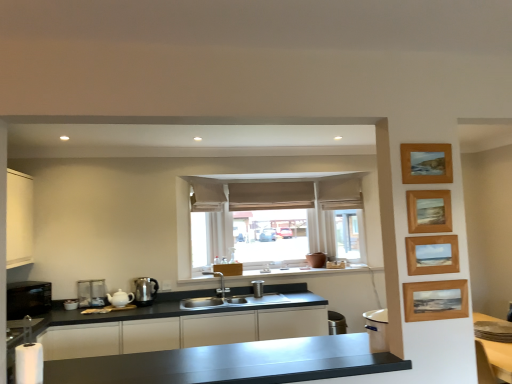
Image resolution: width=512 pixels, height=384 pixels. What do you see at coordinates (19, 219) in the screenshot?
I see `white matte cabinet at left, the 1th cabinetry from the left` at bounding box center [19, 219].

Identify the location of white matte cabinet at left, the 2th cabinetry positioned from the bottom. (19, 219).

How much space does wooden picture frame at upper right, which is counted as the fourth picture frame, starting from the bottom, occupy horizontally?

1.25 inches.

At what (x,y) coordinates should I click in order to perform the action: click on white glossy window sill at center. Please return your answer as a coordinate pair (x, y). Looking at the image, I should click on (297, 273).

Describe the element at coordinates (233, 363) in the screenshot. The height and width of the screenshot is (384, 512). I see `satin black countertop at lower left` at that location.

Where is `white fabric curtain at upper center, arranged as the third curtain when viewed from the right`? white fabric curtain at upper center, arranged as the third curtain when viewed from the right is located at coordinates (207, 196).

In order to face satin black countertop at center, which is the 1th cabinetry from bottom to top, should I rotate leftwards or rightwards?

A 7.778 degree turn to the left will do.

Describe the element at coordinates (91, 293) in the screenshot. I see `satin black coffee machine at lower left` at that location.

Locate an element on the screen. Image resolution: width=512 pixels, height=384 pixels. white matte cabinet at left, placed as the 1th cabinetry when sorted from top to bottom is located at coordinates (19, 219).

Is satin black countertop at center, placed as the 2th cabinetry when sorted from left to right, in front of or behind satin silver canister at center, the 1th appliance in the right-to-left sequence, in the image?

Visually, satin black countertop at center, placed as the 2th cabinetry when sorted from left to right, is located in front of satin silver canister at center, the 1th appliance in the right-to-left sequence.

From a real-world perspective, who is located lower, satin black countertop at center, arranged as the 1th cabinetry when viewed from the right, or satin silver canister at center, the 1th appliance in the right-to-left sequence?

satin black countertop at center, arranged as the 1th cabinetry when viewed from the right, from a real-world perspective.

Identify the location of the 1st cabinetry in front of the satin silver canister at center, placed as the third appliance when sorted from front to back, starting your count from the anchor. (182, 332).

Is wooden picture frame at upper right, the 3th picture frame ordered from the bottom, behind black matte microwave at left, arranged as the third appliance when viewed from the right?

No, the depth of wooden picture frame at upper right, the 3th picture frame ordered from the bottom, is less than that of black matte microwave at left, arranged as the third appliance when viewed from the right.

From a real-world perspective, is wooden picture frame at upper right, the 3th picture frame ordered from the bottom, under black matte microwave at left, positioned as the 1th appliance in left-to-right order?

Incorrect, from a real-world perspective, wooden picture frame at upper right, the 3th picture frame ordered from the bottom, is higher than black matte microwave at left, positioned as the 1th appliance in left-to-right order.

From the image's perspective, is wooden picture frame at upper right, the 3th picture frame ordered from the bottom, above or below black matte microwave at left, which appears as the third appliance when viewed from the back?

From the image's perspective, wooden picture frame at upper right, the 3th picture frame ordered from the bottom, appears above black matte microwave at left, which appears as the third appliance when viewed from the back.

Based on the photo, is wooden picture frame at upper right, the 3th picture frame ordered from the bottom, inside the boundaries of black matte microwave at left, positioned as the 1th appliance in left-to-right order, or outside?

wooden picture frame at upper right, the 3th picture frame ordered from the bottom, is outside black matte microwave at left, positioned as the 1th appliance in left-to-right order.

Can you confirm if satin silver kettle at lower left, the second appliance in the right-to-left sequence, is positioned to the left of wooden picture frame at right, acting as the first picture frame starting from the bottom?

Indeed, satin silver kettle at lower left, the second appliance in the right-to-left sequence, is positioned on the left side of wooden picture frame at right, acting as the first picture frame starting from the bottom.

In the scene shown: Does satin silver kettle at lower left, the second appliance in the right-to-left sequence, turn towards wooden picture frame at right, acting as the first picture frame starting from the bottom?

No, satin silver kettle at lower left, the second appliance in the right-to-left sequence, is not oriented towards wooden picture frame at right, acting as the first picture frame starting from the bottom.

From a real-world perspective, between satin silver kettle at lower left, the second appliance when ordered from left to right, and wooden picture frame at right, which ranks as the fourth picture frame in top-to-bottom order, who is vertically lower?

In real-world perspective, satin silver kettle at lower left, the second appliance when ordered from left to right, is lower.

Which object is more forward, satin silver kettle at lower left, the second appliance when ordered from left to right, or wooden picture frame at right, acting as the first picture frame starting from the bottom?

Positioned in front is wooden picture frame at right, acting as the first picture frame starting from the bottom.

Is white matte cabinet at left, the 2th cabinetry positioned from the bottom, turned away from white glossy window sill at center?

That's not correct — white matte cabinet at left, the 2th cabinetry positioned from the bottom, is not looking away from white glossy window sill at center.

Is white glossy window sill at center surrounded by white matte cabinet at left, the 2th cabinetry positioned from the right?

No, white glossy window sill at center is located outside of white matte cabinet at left, the 2th cabinetry positioned from the right.

Which object is positioned more to the left, white matte cabinet at left, the 2th cabinetry positioned from the right, or white glossy window sill at center?

white matte cabinet at left, the 2th cabinetry positioned from the right.

From the image's perspective, between white matte cabinet at left, the 2th cabinetry positioned from the right, and white glossy window sill at center, which one is located above?

white matte cabinet at left, the 2th cabinetry positioned from the right.

How far apart are white fabric curtain at upper center, positioned as the 1th curtain in left-to-right order, and satin black countertop at lower left?

A distance of 2.49 meters exists between white fabric curtain at upper center, positioned as the 1th curtain in left-to-right order, and satin black countertop at lower left.

Looking at their sizes, would you say white fabric curtain at upper center, arranged as the third curtain when viewed from the right, is wider or thinner than satin black countertop at lower left?

In the image, white fabric curtain at upper center, arranged as the third curtain when viewed from the right, appears to be more narrow than satin black countertop at lower left.

Is satin black countertop at lower left inside white fabric curtain at upper center, arranged as the third curtain when viewed from the right?

No, satin black countertop at lower left is not surrounded by white fabric curtain at upper center, arranged as the third curtain when viewed from the right.

Which of these two, white glossy window sill at center or satin black countertop at center, arranged as the 1th cabinetry when viewed from the right, is smaller?

white glossy window sill at center is smaller.

Can you tell me how much white glossy window sill at center and satin black countertop at center, the second cabinetry in the top-to-bottom sequence, differ in facing direction?

The angle between the facing direction of white glossy window sill at center and the facing direction of satin black countertop at center, the second cabinetry in the top-to-bottom sequence, is 0.909 degrees.

From the picture: Can satin black countertop at center, the second cabinetry in the top-to-bottom sequence, be found inside white glossy window sill at center?

No, satin black countertop at center, the second cabinetry in the top-to-bottom sequence, is located outside of white glossy window sill at center.

Is white glossy window sill at center positioned with its back to satin black countertop at center, arranged as the 1th cabinetry when viewed from the right?

No.

Is satin black coffee machine at lower left far from beige fabric curtain at center, which appears as the second curtain when viewed from the left?

Absolutely, satin black coffee machine at lower left is distant from beige fabric curtain at center, which appears as the second curtain when viewed from the left.

Is satin black coffee machine at lower left not inside beige fabric curtain at center, which appears as the second curtain when viewed from the left?

satin black coffee machine at lower left is positioned outside beige fabric curtain at center, which appears as the second curtain when viewed from the left.

Considering the relative sizes of satin black coffee machine at lower left and beige fabric curtain at center, arranged as the 2th curtain when viewed from the right, in the image provided, is satin black coffee machine at lower left bigger than beige fabric curtain at center, arranged as the 2th curtain when viewed from the right,?

Actually, satin black coffee machine at lower left might be smaller than beige fabric curtain at center, arranged as the 2th curtain when viewed from the right.

Does satin black coffee machine at lower left turn towards beige fabric curtain at center, arranged as the 2th curtain when viewed from the right?

No, satin black coffee machine at lower left does not turn towards beige fabric curtain at center, arranged as the 2th curtain when viewed from the right.

Locate an element on the screen. the 3rd appliance behind the satin black countertop at center, which is the 1th cabinetry from bottom to top is located at coordinates (x=257, y=288).

Where is `picture frame that is the 3rd object above the black matte microwave at left, positioned as the 1th appliance in left-to-right order (from a real-world perspective)`? Image resolution: width=512 pixels, height=384 pixels. picture frame that is the 3rd object above the black matte microwave at left, positioned as the 1th appliance in left-to-right order (from a real-world perspective) is located at coordinates (429, 211).

From the image, which object appears to be nearer to satin silver canister at center, the 1th appliance in the right-to-left sequence, white matte cabinet at left, the 2th cabinetry positioned from the right, or wooden picture frame at upper right, which is counted as the fourth picture frame, starting from the bottom?

white matte cabinet at left, the 2th cabinetry positioned from the right.

When comparing their distances from beige fabric curtain at upper center, which is the first curtain from right to left, does white glossy teapot at left or white fabric curtain at upper center, positioned as the 1th curtain in left-to-right order, seem further?

The object further to beige fabric curtain at upper center, which is the first curtain from right to left, is white glossy teapot at left.

Which object lies further to the anchor point wooden picture frame at upper right, which is the second picture frame in top-to-bottom order, white matte cabinet at left, the 1th cabinetry from the left, or satin black countertop at center, arranged as the 1th cabinetry when viewed from the right?

white matte cabinet at left, the 1th cabinetry from the left, is further to wooden picture frame at upper right, which is the second picture frame in top-to-bottom order.

When comparing their distances from beige fabric curtain at center, arranged as the 2th curtain when viewed from the right, does satin black countertop at center, which is the 1th cabinetry from bottom to top, or satin silver kettle at lower left, the second appliance in the right-to-left sequence, seem further?

satin black countertop at center, which is the 1th cabinetry from bottom to top.

Based on their spatial positions, is wooden picture frame at upper right, which is counted as the fourth picture frame, starting from the bottom, or black matte microwave at left, arranged as the third appliance when viewed from the right, closer to beige fabric curtain at center, arranged as the 2th curtain when viewed from the right?

black matte microwave at left, arranged as the third appliance when viewed from the right.

When comparing their distances from satin black countertop at center, which is the 1th cabinetry from bottom to top, does white glossy teapot at left or wooden picture frame at upper right, which is counted as the fourth picture frame, starting from the bottom, seem closer?

white glossy teapot at left lies closer to satin black countertop at center, which is the 1th cabinetry from bottom to top, than the other object.

Looking at the image, which one is located closer to black matte microwave at left, positioned as the 1th appliance in left-to-right order, satin black countertop at lower left or wooden picture frame at upper right, which is counted as the fourth picture frame, starting from the bottom?

satin black countertop at lower left is closer to black matte microwave at left, positioned as the 1th appliance in left-to-right order.

From the picture: Which object lies nearer to the anchor point white glossy teapot at left, satin silver canister at center, the 3th appliance when ordered from left to right, or wooden picture frame at right, the 2th picture frame in the bottom-to-top sequence?

satin silver canister at center, the 3th appliance when ordered from left to right, lies closer to white glossy teapot at left than the other object.

Locate an element on the screen. coffee machine positioned between wooden picture frame at right, the 2th picture frame in the bottom-to-top sequence, and white fabric curtain at upper center, positioned as the 1th curtain in left-to-right order, from near to far is located at coordinates (91, 293).

You are a GUI agent. You are given a task and a screenshot of the screen. Output one action in this format:
    pyautogui.click(x=<x>, y=<y>)
    Task: Click on the cabinetry located between black matte microwave at left, which appears as the third appliance when viewed from the back, and satin silver canister at center, placed as the third appliance when sorted from front to back, in the left-right direction
    
    Given the screenshot: What is the action you would take?
    pyautogui.click(x=182, y=332)

Find the location of `tea pot between satin black coffee machine at lower left and satin silver canister at center, placed as the third appliance when sorted from front to back, from left to right`. tea pot between satin black coffee machine at lower left and satin silver canister at center, placed as the third appliance when sorted from front to back, from left to right is located at coordinates (120, 298).

Locate an element on the screen. The height and width of the screenshot is (384, 512). tea pot between wooden picture frame at upper right, which is counted as the fourth picture frame, starting from the bottom, and beige fabric curtain at center, which appears as the second curtain when viewed from the left, along the z-axis is located at coordinates (120, 298).